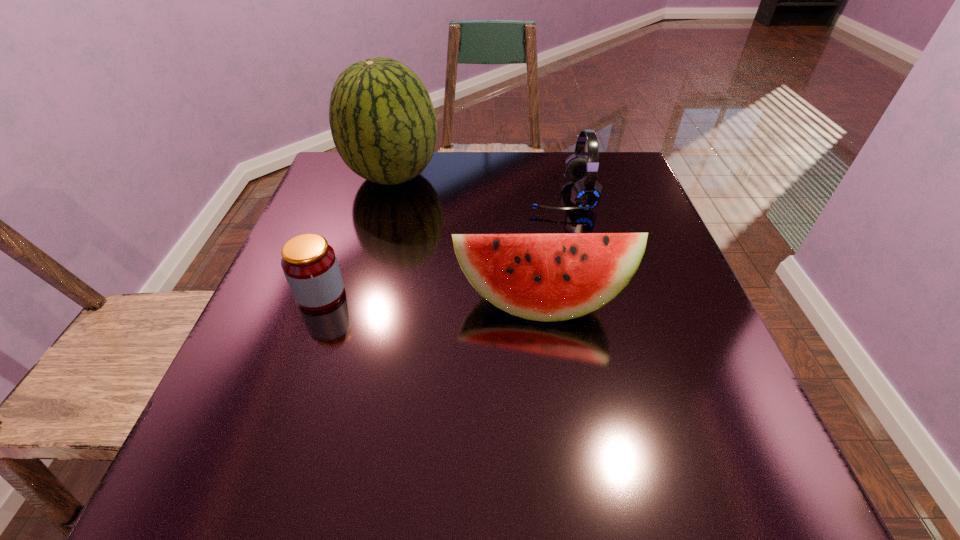
This screenshot has width=960, height=540. Find the location of `vacant space located on the ear cushions of the headset`. vacant space located on the ear cushions of the headset is located at coordinates (424, 195).

Image resolution: width=960 pixels, height=540 pixels. Find the location of `vacant space located 0.140m on the front of the shortest object`. vacant space located 0.140m on the front of the shortest object is located at coordinates [x=291, y=375].

The width and height of the screenshot is (960, 540). Identify the location of watermelon that is positioned at the far edge. (383, 124).

Locate an element on the screen. headset located at the far edge is located at coordinates (586, 193).

Find the location of a particular element. This screenshot has width=960, height=540. watermelon located at the left edge is located at coordinates (383, 124).

Identify the location of jar located in the left edge section of the desktop. (309, 263).

Find the location of a particular element. The width and height of the screenshot is (960, 540). watermelon that is at the right edge is located at coordinates (544, 277).

Image resolution: width=960 pixels, height=540 pixels. Identify the location of headset that is positioned at the right edge. (586, 193).

I want to click on object that is at the far left corner, so click(383, 124).

Locate an element on the screen. object that is at the far right corner is located at coordinates (586, 193).